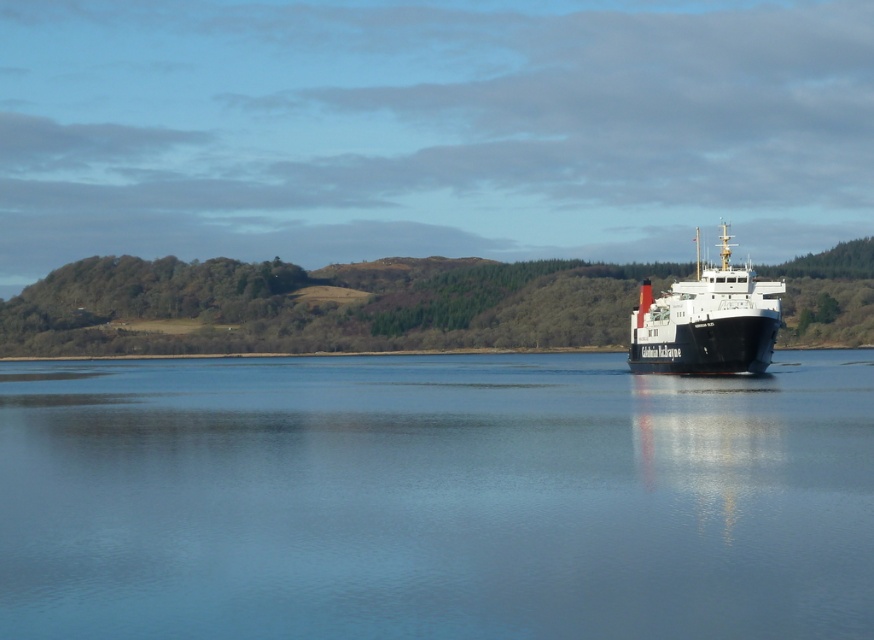
Question: Does blue water at center have a lesser width compared to black matte ship at right?

Choices:
 (A) no
 (B) yes

Answer: (A)

Question: Does blue water at center appear under black matte ship at right?

Choices:
 (A) no
 (B) yes

Answer: (B)

Question: In this image, where is blue water at center located relative to black matte ship at right?

Choices:
 (A) above
 (B) below

Answer: (B)